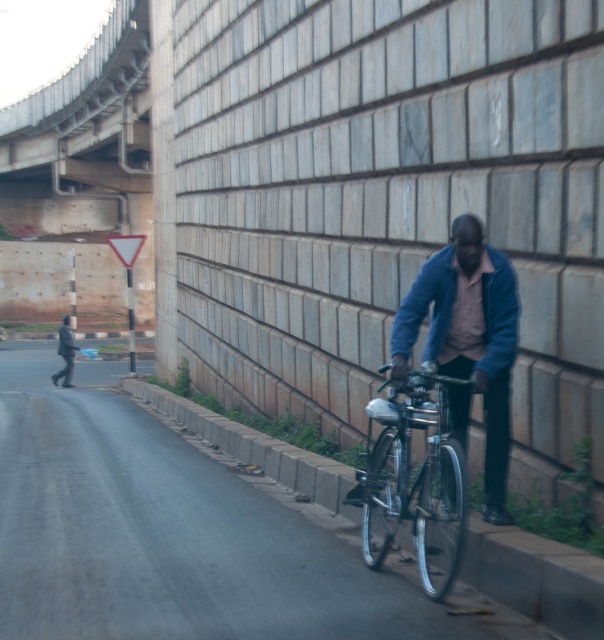
Who is positioned more to the left, silver metallic bicycle at right or blue matte jacket at center?

From the viewer's perspective, silver metallic bicycle at right appears more on the left side.

Is silver metallic bicycle at right closer to the viewer compared to blue matte jacket at center?

Yes, it is.

Who is more forward, (451, 532) or (442, 257)?

Positioned in front is point (451, 532).

At what (x,y) coordinates should I click in order to perform the action: click on silver metallic bicycle at right. Please return your answer as a coordinate pair (x, y). Looking at the image, I should click on (416, 483).

The image size is (604, 640). I want to click on metallic bicycle at right, so click(158, 531).

What do you see at coordinates (158, 531) in the screenshot? I see `metallic bicycle at right` at bounding box center [158, 531].

Who is more forward, (27, 438) or (399, 449)?

Point (399, 449) is more forward.

Find the location of a particular element. This screenshot has width=604, height=640. metallic bicycle at right is located at coordinates (158, 531).

Which of these two, blue fabric jacket at center or blue matte jacket at center, stands taller?

blue fabric jacket at center is taller.

Between blue fabric jacket at center and blue matte jacket at center, which one has less height?

blue matte jacket at center is shorter.

Image resolution: width=604 pixels, height=640 pixels. I want to click on blue fabric jacket at center, so click(x=467, y=337).